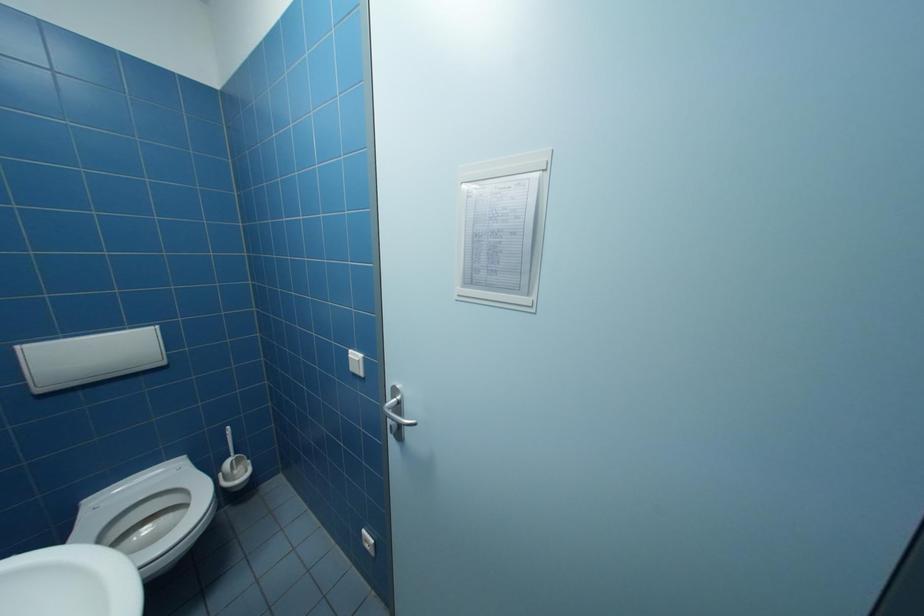
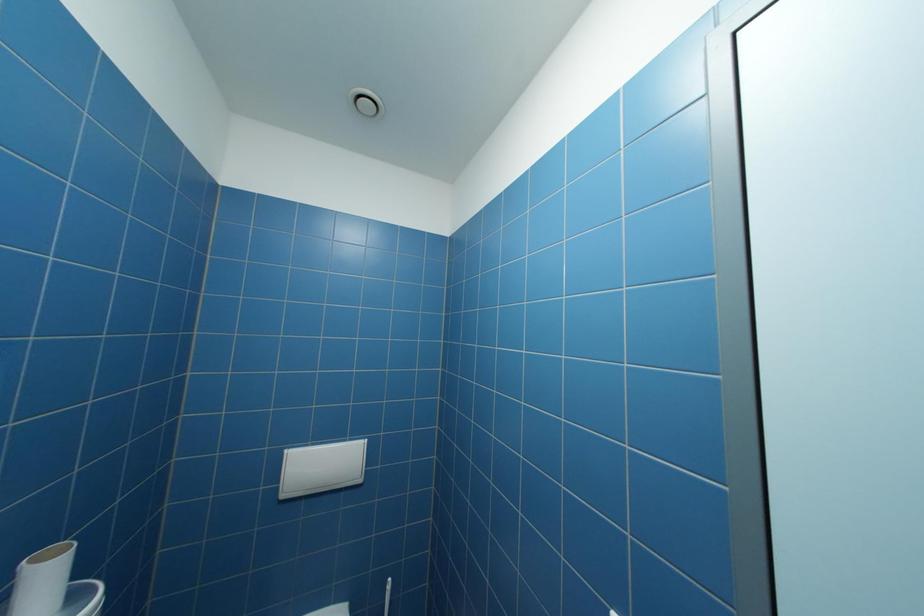
Based on the continuous images, in which direction is the camera rotating?

The camera's rotation is toward left-up.